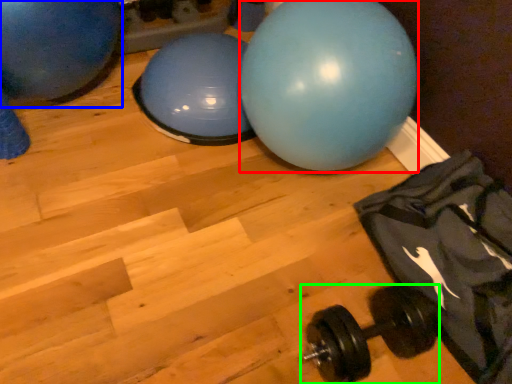
Question: Which object is positioned farthest from ball (highlighted by a red box)? Select from ball (highlighted by a blue box) and dumbbell (highlighted by a green box).

Choices:
 (A) ball
 (B) dumbbell

Answer: (A)